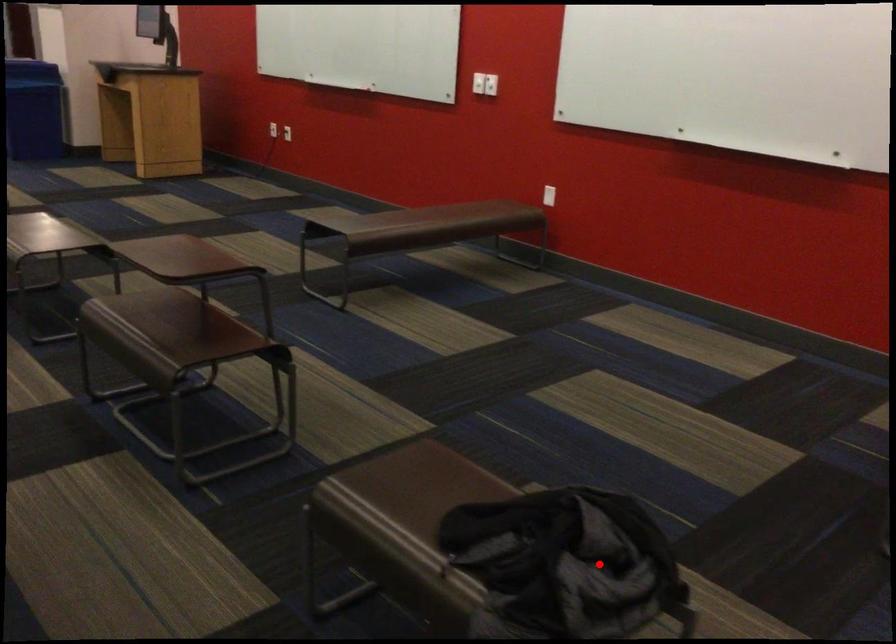
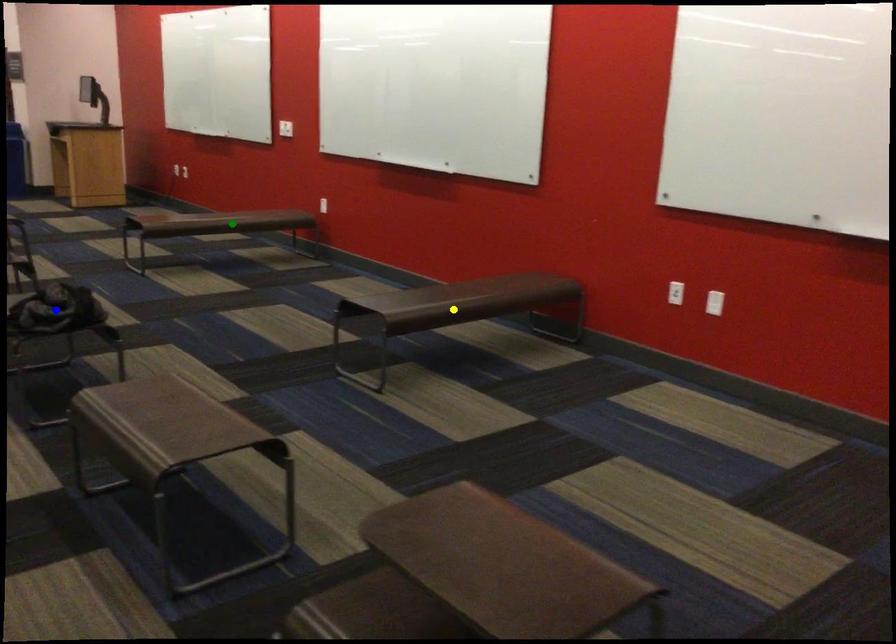
Question: I am providing you with two images of the same scene from different viewpoints. A red point is marked on the first image. You are given multiple points on the second image. Which point in image 2 is actually the same real-world point as the red point in image 1?

Choices:
 (A) green point
 (B) yellow point
 (C) blue point

Answer: (C)